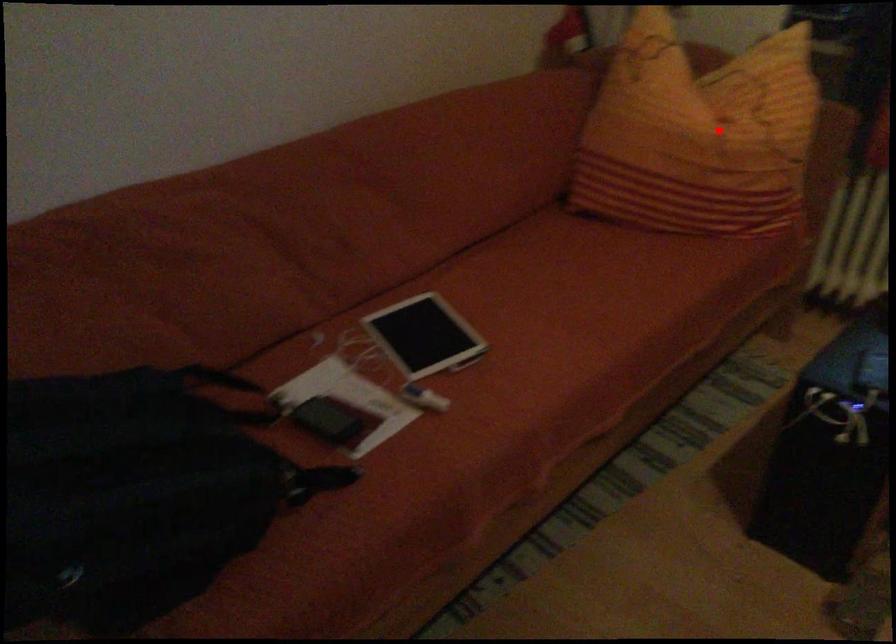
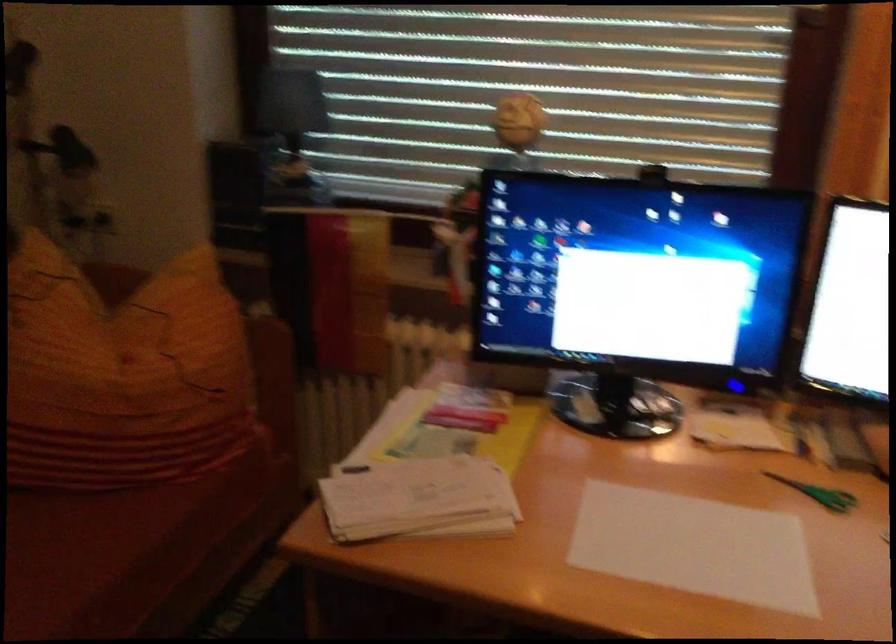
Question: I am providing you with two images of the same scene from different viewpoints. A red point is shown in image1. For the corresponding object point in image2, is it positioned nearer or farther from the camera?

Choices:
 (A) Nearer
 (B) Farther

Answer: (A)